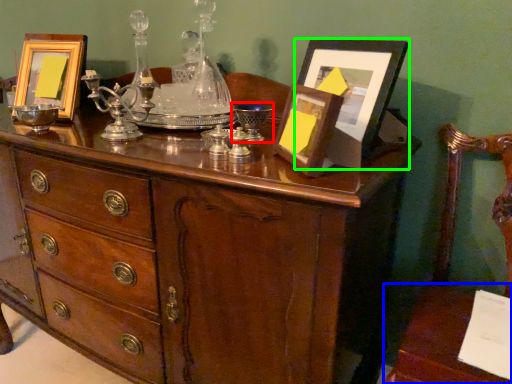
Question: Considering the real-world distances, which object is closest to wine glass (highlighted by a red box)? table (highlighted by a blue box) or picture frame (highlighted by a green box).

Choices:
 (A) table
 (B) picture frame

Answer: (B)